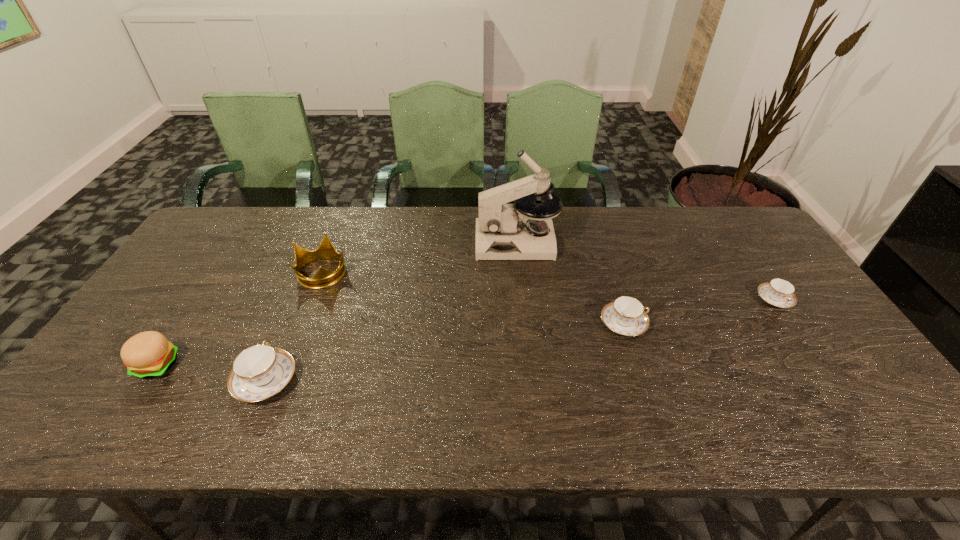
Find the location of a particular element. The height and width of the screenshot is (540, 960). object present at the far edge is located at coordinates point(504,231).

I want to click on teacup located at the near edge, so click(x=260, y=371).

This screenshot has height=540, width=960. What are the coordinates of `hamburger that is at the near edge` in the screenshot? It's located at (149, 354).

This screenshot has height=540, width=960. What are the coordinates of `object located at the left edge` in the screenshot? It's located at (149, 354).

At what (x,y) coordinates should I click in order to perform the action: click on object present at the right edge. Please return your answer as a coordinate pair (x, y). The image size is (960, 540). Looking at the image, I should click on (778, 292).

You are a GUI agent. You are given a task and a screenshot of the screen. Output one action in this format:
    pyautogui.click(x=<x>, y=<y>)
    Task: Click on the object that is positioned at the near left corner
    This screenshot has height=540, width=960.
    Given the screenshot: What is the action you would take?
    pyautogui.click(x=149, y=354)

Locate an element on the screen. This screenshot has width=960, height=540. vacant space at the far edge of the desktop is located at coordinates (418, 231).

Where is `vacant space at the near edge of the desktop`? The image size is (960, 540). vacant space at the near edge of the desktop is located at coordinates (318, 397).

This screenshot has height=540, width=960. What are the coordinates of `vacant space at the right edge of the desktop` in the screenshot? It's located at (812, 343).

The height and width of the screenshot is (540, 960). I want to click on vacant space at the far left corner, so click(x=253, y=215).